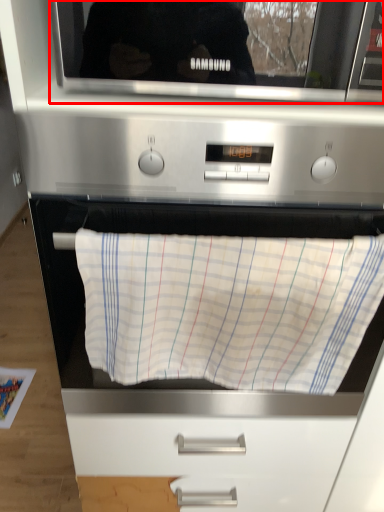
Question: From the image's perspective, where is microwave oven (annotated by the red box) located in relation to blanket in the image?

Choices:
 (A) below
 (B) above

Answer: (B)